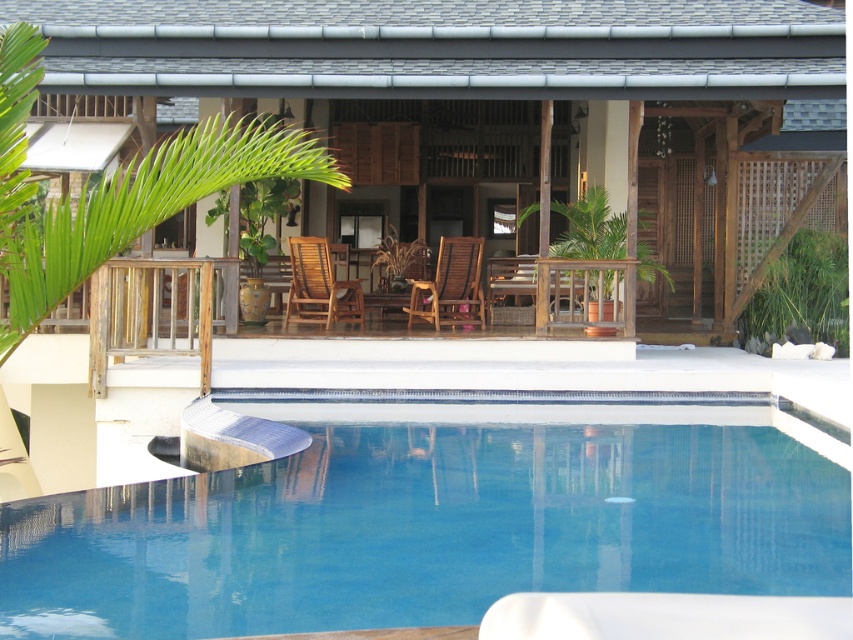
Which of these two, clear glass pool at center or brown wooden armchair at center, stands taller?

With more height is brown wooden armchair at center.

You are a GUI agent. You are given a task and a screenshot of the screen. Output one action in this format:
    pyautogui.click(x=<x>, y=<y>)
    Task: Click on the clear glass pool at center
    The width and height of the screenshot is (853, 640).
    Given the screenshot: What is the action you would take?
    pyautogui.click(x=436, y=520)

Between wooden hut at center and clear glass pool at center, which one appears on the left side from the viewer's perspective?

wooden hut at center

Is wooden hut at center below clear glass pool at center?

Incorrect, wooden hut at center is not positioned below clear glass pool at center.

At what (x,y) coordinates should I click in order to perform the action: click on wooden hut at center. Please return your answer as a coordinate pair (x, y). Image resolution: width=853 pixels, height=640 pixels. Looking at the image, I should click on (491, 120).

Does wooden hut at center appear under brown wooden armchair at center?

No, wooden hut at center is not below brown wooden armchair at center.

The width and height of the screenshot is (853, 640). What do you see at coordinates (491, 120) in the screenshot?
I see `wooden hut at center` at bounding box center [491, 120].

You are a GUI agent. You are given a task and a screenshot of the screen. Output one action in this format:
    pyautogui.click(x=<x>, y=<y>)
    Task: Click on the wooden hut at center
    This screenshot has width=853, height=640.
    Given the screenshot: What is the action you would take?
    pyautogui.click(x=491, y=120)